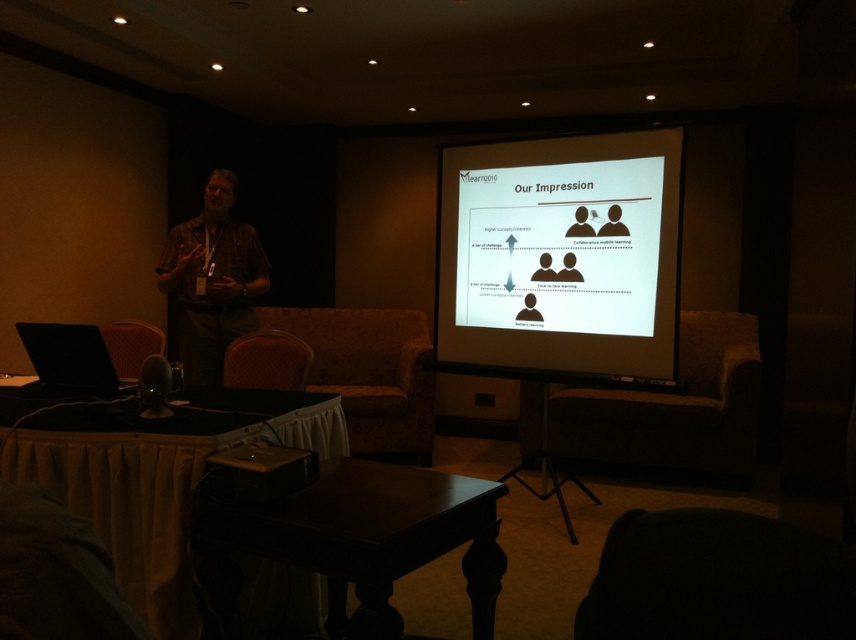
Does white glossy projector screen at upper center appear on the left side of velvet red armchair at lower left?

In fact, white glossy projector screen at upper center is to the right of velvet red armchair at lower left.

Which is more to the left, white glossy projector screen at upper center or velvet red armchair at lower left?

velvet red armchair at lower left

Image resolution: width=856 pixels, height=640 pixels. I want to click on white glossy projector screen at upper center, so click(562, 257).

Image resolution: width=856 pixels, height=640 pixels. Identify the location of white glossy projector screen at upper center. (562, 257).

Is brown fabric armchair at center wider than matte black laptop at left?

Yes.

Which is more to the right, brown fabric armchair at center or matte black laptop at left?

brown fabric armchair at center is more to the right.

Is point (682, 451) positioned before point (76, 374)?

No, it is not.

Find the location of `brown fabric armchair at center`. brown fabric armchair at center is located at coordinates (672, 406).

Does point (452, 358) come closer to viewer compared to point (836, 636)?

No, it is behind (836, 636).

Which is more to the right, white glossy projector screen at upper center or dark fabric armchair at lower right?

From the viewer's perspective, white glossy projector screen at upper center appears more on the right side.

Between point (468, 157) and point (738, 516), which one is positioned in front?

Positioned in front is point (738, 516).

Locate an element on the screen. This screenshot has width=856, height=640. white glossy projector screen at upper center is located at coordinates tap(562, 257).